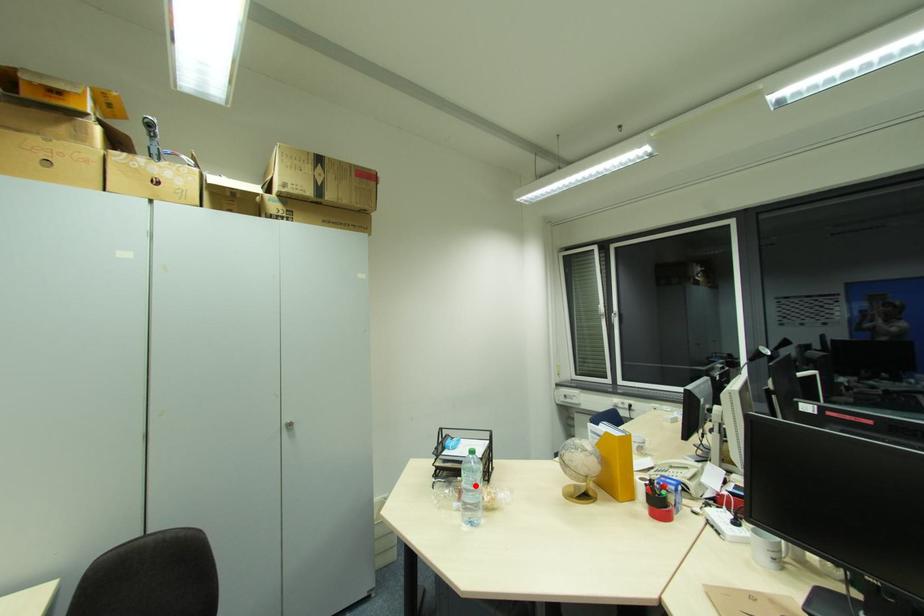
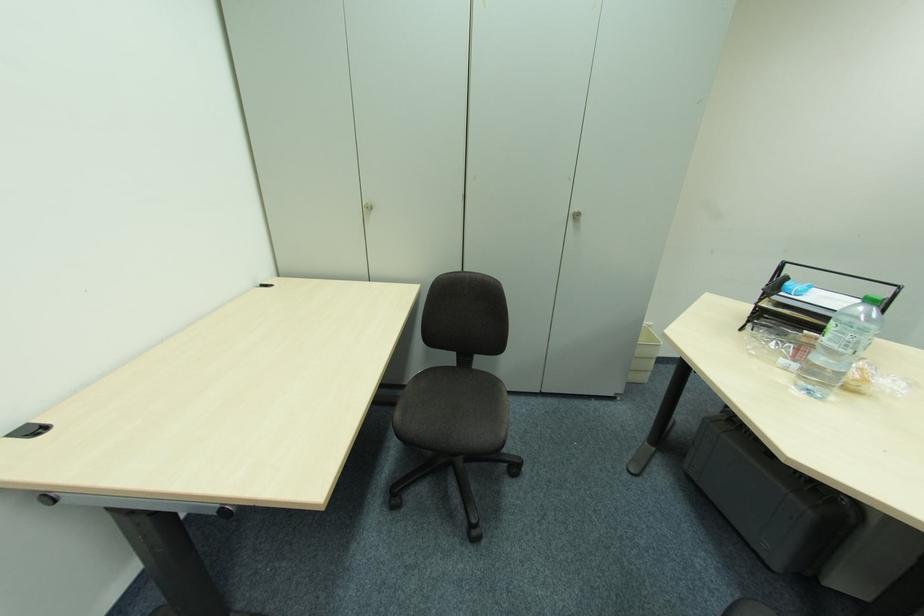
In the second image, find the point that corresponds to the highlighted location in the first image.

(850, 347)